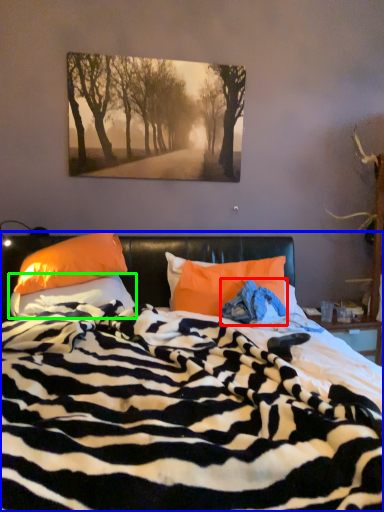
Question: Which object is the closest to the material (highlighted by a red box)? Choose among these: bed (highlighted by a blue box) or pillow (highlighted by a green box).

Choices:
 (A) bed
 (B) pillow

Answer: (A)